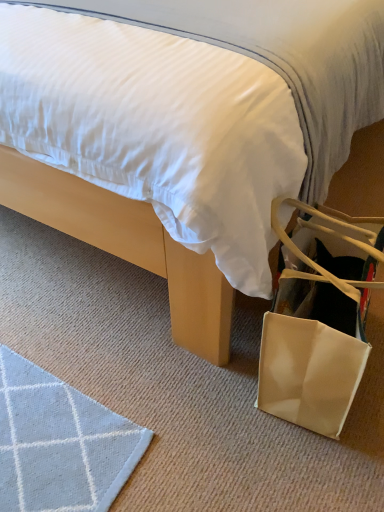
The image size is (384, 512). What do you see at coordinates (293, 64) in the screenshot?
I see `matte white bed at lower right` at bounding box center [293, 64].

In order to face matte white bed at lower right, should I rotate leftwards or rightwards?

A 3.302 degree turn to the left will do.

Find the location of a particular element. matte white bed at lower right is located at coordinates (293, 64).

The height and width of the screenshot is (512, 384). I want to click on matte white bed at lower right, so click(293, 64).